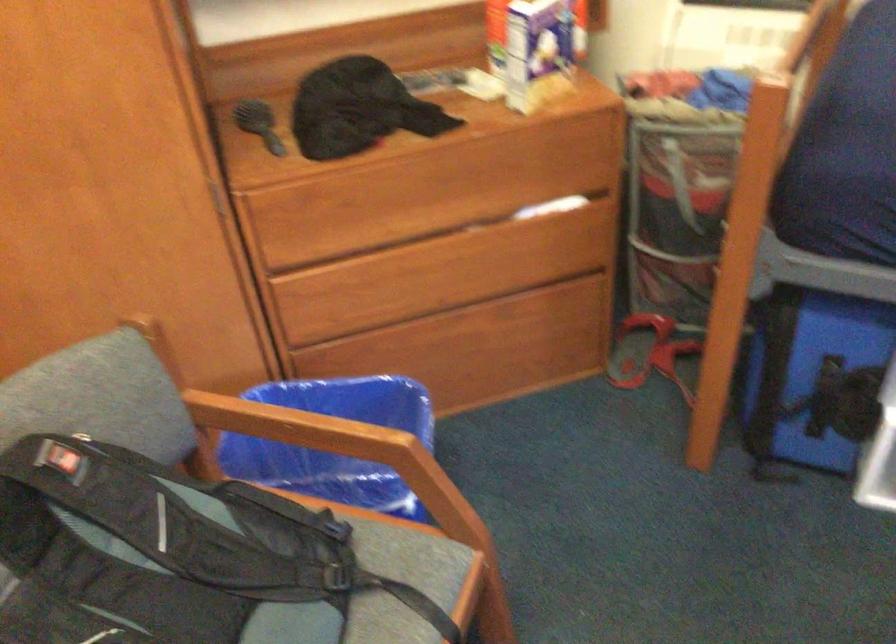
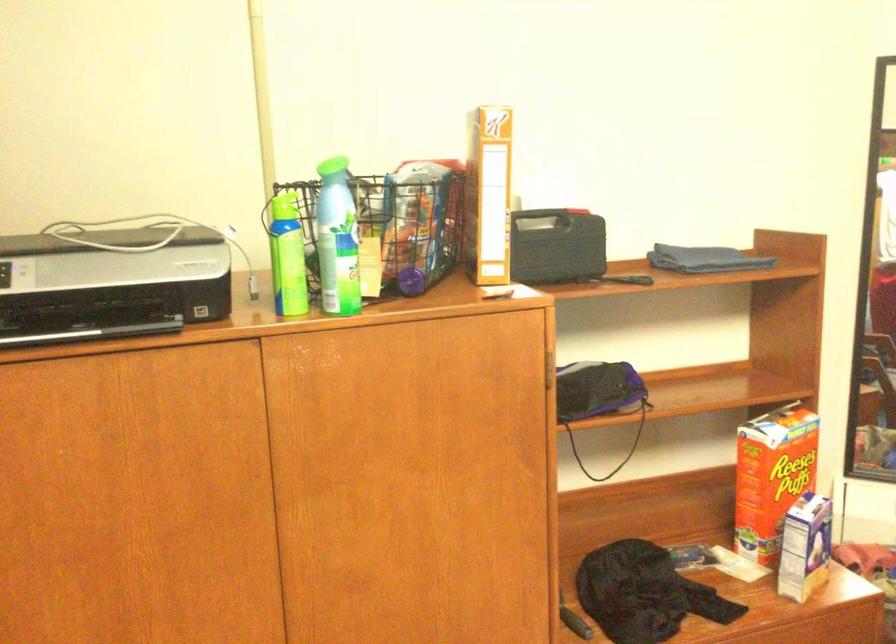
Where in the second image is the point corresponding to the point at 358,111 from the first image?

(643, 592)